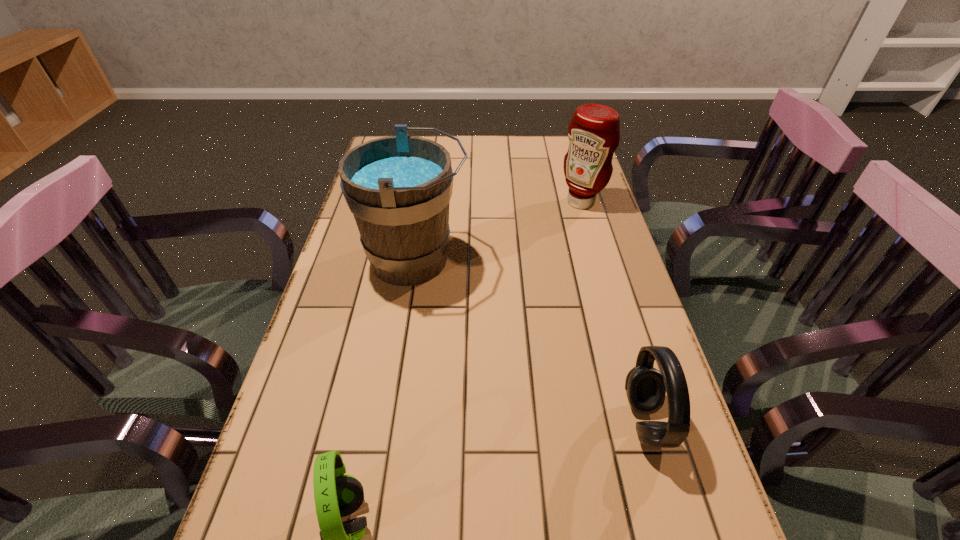
You are a GUI agent. You are given a task and a screenshot of the screen. Output one action in this format:
    pyautogui.click(x=<x>, y=<y>)
    Task: Click on the third nearest object
    Image resolution: width=960 pixels, height=540 pixels.
    Given the screenshot: What is the action you would take?
    pyautogui.click(x=398, y=188)

At what (x,y) coordinates should I click in order to perform the action: click on the farthest object. Please return your answer as a coordinate pair (x, y). Looking at the image, I should click on (594, 131).

In order to click on the farther headset in this screenshot , I will do `click(646, 387)`.

Where is `the third farthest object`? Image resolution: width=960 pixels, height=540 pixels. the third farthest object is located at coordinates pyautogui.click(x=646, y=387).

Find the location of `free space located 0.320m with a handle on the side of the wine bucket`. free space located 0.320m with a handle on the side of the wine bucket is located at coordinates (587, 260).

The image size is (960, 540). In order to click on free space located on the back of the condiment in this screenshot , I will do `click(576, 183)`.

This screenshot has width=960, height=540. I want to click on vacant space located 0.070m on the earcups of the third farthest object, so click(x=591, y=421).

I want to click on vacant position located on the earcups of the third farthest object, so (475, 421).

Find the location of a particular element. This screenshot has width=960, height=540. vacant area located on the earcups of the third farthest object is located at coordinates (511, 421).

You are a GUI agent. You are given a task and a screenshot of the screen. Output one action in this format:
    pyautogui.click(x=<x>, y=<y>)
    Task: Click on the object at the left edge
    This screenshot has height=540, width=960.
    Given the screenshot: What is the action you would take?
    pyautogui.click(x=398, y=188)